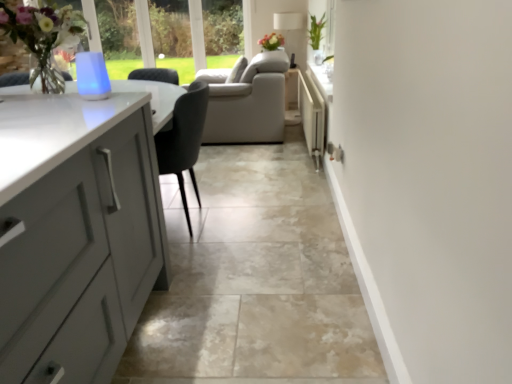
Question: Can you confirm if green leafy plant at upper right is taller than matte floral arrangement at center?

Choices:
 (A) no
 (B) yes

Answer: (B)

Question: Are green leafy plant at upper right and matte floral arrangement at center located far from each other?

Choices:
 (A) yes
 (B) no

Answer: (B)

Question: Considering the relative sizes of green leafy plant at upper right and matte floral arrangement at center in the image provided, is green leafy plant at upper right wider than matte floral arrangement at center?

Choices:
 (A) yes
 (B) no

Answer: (B)

Question: Does green leafy plant at upper right have a lesser width compared to matte floral arrangement at center?

Choices:
 (A) no
 (B) yes

Answer: (B)

Question: From the image's perspective, is green leafy plant at upper right located above matte floral arrangement at center?

Choices:
 (A) yes
 (B) no

Answer: (B)

Question: Is matte gray cabinets at left wider or thinner than white plastic radiator at center-right?

Choices:
 (A) wide
 (B) thin

Answer: (A)

Question: From a real-world perspective, is matte gray cabinets at left above or below white plastic radiator at center-right?

Choices:
 (A) below
 (B) above

Answer: (A)

Question: Based on their positions, is matte gray cabinets at left located to the left or right of white plastic radiator at center-right?

Choices:
 (A) right
 (B) left

Answer: (B)

Question: Considering the positions of matte gray cabinets at left and white plastic radiator at center-right in the image, is matte gray cabinets at left bigger or smaller than white plastic radiator at center-right?

Choices:
 (A) small
 (B) big

Answer: (B)

Question: Visually, is white plastic radiator at center-right positioned to the left or to the right of matte floral arrangement at center?

Choices:
 (A) right
 (B) left

Answer: (A)

Question: Is white plastic radiator at center-right inside or outside of matte floral arrangement at center?

Choices:
 (A) outside
 (B) inside

Answer: (A)

Question: From a real-world perspective, relative to matte floral arrangement at center, is white plastic radiator at center-right vertically above or below?

Choices:
 (A) above
 (B) below

Answer: (B)

Question: Looking at their shapes, would you say white plastic radiator at center-right is wider or thinner than matte floral arrangement at center?

Choices:
 (A) thin
 (B) wide

Answer: (A)

Question: Is point (306, 115) positioned closer to the camera than point (226, 271)?

Choices:
 (A) closer
 (B) farther

Answer: (B)

Question: Based on their sizes in the image, would you say white plastic radiator at center-right is bigger or smaller than matte gray cabinets at left?

Choices:
 (A) small
 (B) big

Answer: (A)